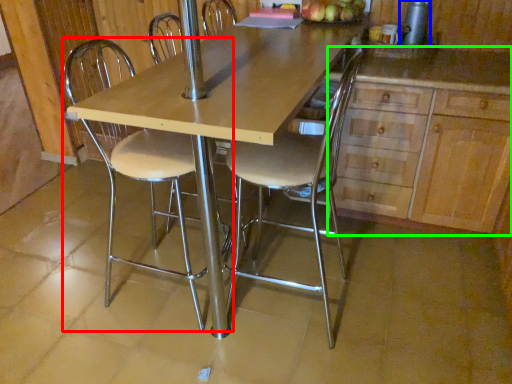
Question: Which is nearer to the chair (highlighted by a red box)? appliance (highlighted by a blue box) or cabinetry (highlighted by a green box).

Choices:
 (A) appliance
 (B) cabinetry

Answer: (B)